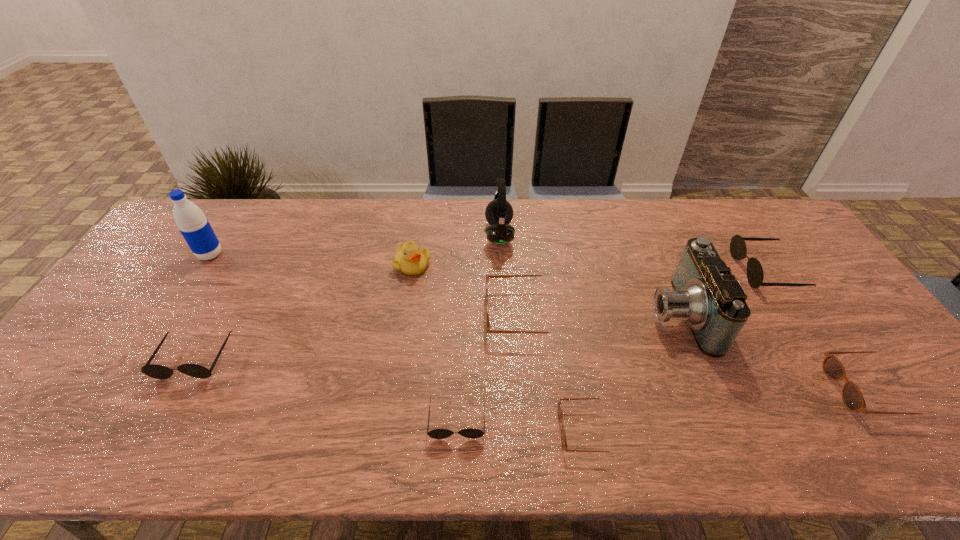
Identify the location of vacant space located 0.120m on the front-facing side of the eighth object from left to right. Image resolution: width=960 pixels, height=540 pixels. (604, 314).

At what (x,y) coordinates should I click in order to perform the action: click on vacant space located 0.260m on the front-facing side of the eighth object from left to right. Please return your answer as a coordinate pair (x, y). Looking at the image, I should click on (554, 314).

Identify the location of free spot located on the front-facing side of the eighth object from left to right. The height and width of the screenshot is (540, 960). (511, 314).

What are the coordinates of `vacant space located 0.240m on the beak of the duckling` in the screenshot? It's located at (399, 341).

Identify the location of vacant space situated 0.090m on the front-facing side of the biggest black sunglasses. (710, 271).

Locate an element on the screen. The width and height of the screenshot is (960, 540). free region located on the front-facing side of the biggest black sunglasses is located at coordinates (664, 271).

Image resolution: width=960 pixels, height=540 pixels. Identify the location of vacant area located on the front-facing side of the biggest black sunglasses. (716, 271).

The height and width of the screenshot is (540, 960). Find the location of `vacant position located 0.180m on the front-facing side of the farthest brown sunglasses`. vacant position located 0.180m on the front-facing side of the farthest brown sunglasses is located at coordinates (421, 314).

The height and width of the screenshot is (540, 960). I want to click on vacant space located on the front-facing side of the farthest brown sunglasses, so click(x=407, y=314).

I want to click on free space located on the front-facing side of the farthest brown sunglasses, so click(x=393, y=314).